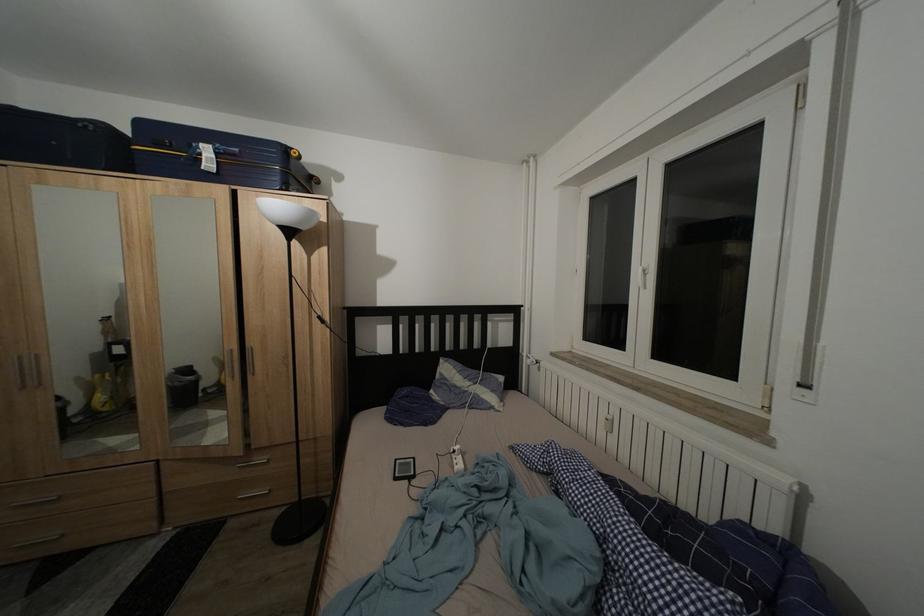
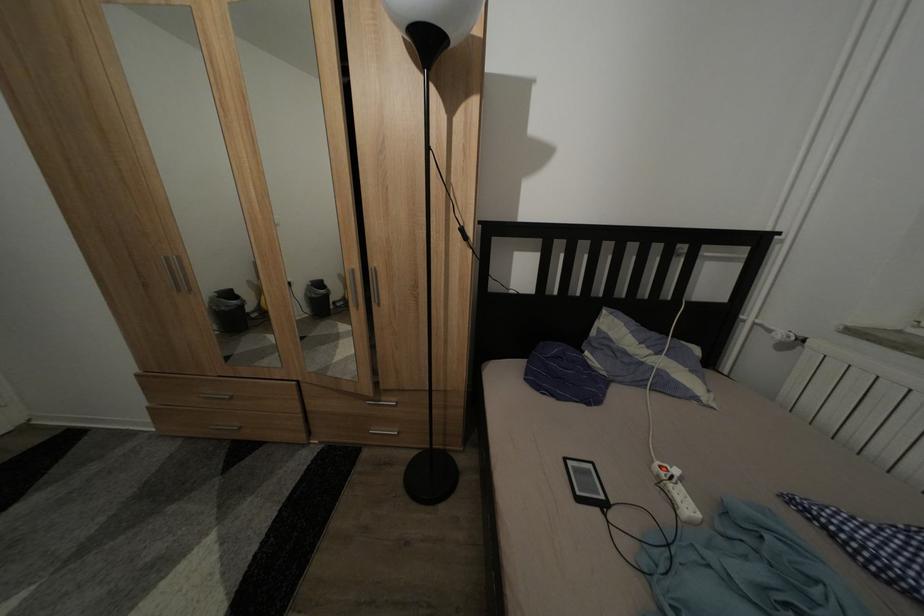
In the scene shown: What movement of the cameraman would produce the second image?

The cameraman walked toward left, forward.